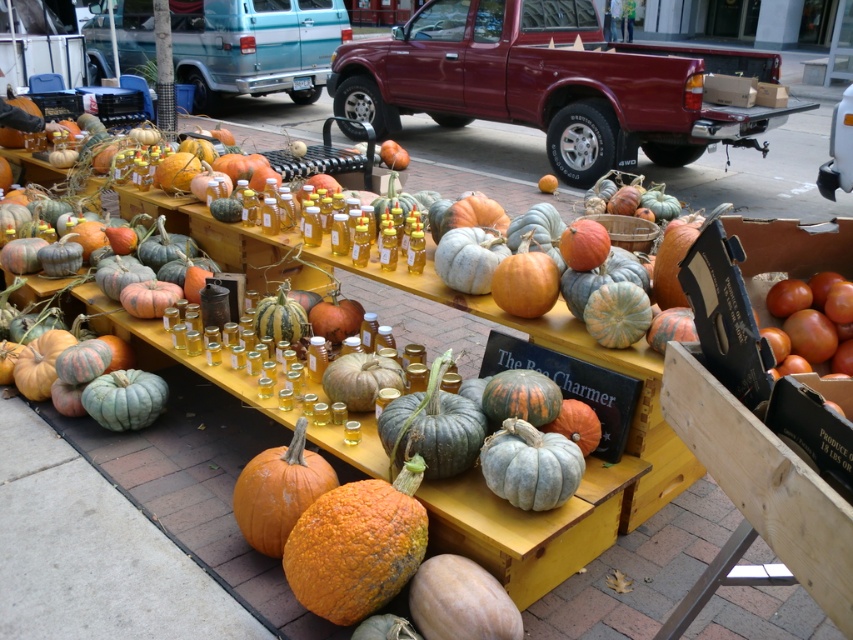
Does orange matte pumpkin at center appear on the right side of speckled gray pumpkin at center?

Incorrect, orange matte pumpkin at center is not on the right side of speckled gray pumpkin at center.

Between orange matte pumpkin at center and speckled gray pumpkin at center, which one has more height?

orange matte pumpkin at center

The image size is (853, 640). What do you see at coordinates (279, 490) in the screenshot?
I see `orange matte pumpkin at center` at bounding box center [279, 490].

Identify the location of orange matte pumpkin at center. (279, 490).

Who is more forward, (276, 541) or (502, 637)?

Point (502, 637)

I want to click on orange matte pumpkin at center, so click(x=279, y=490).

Is matte orange pumpkin at center positioned in front of speckled gray pumpkin at center?

Yes.

Is matte orange pumpkin at center bigger than speckled gray pumpkin at center?

Indeed, matte orange pumpkin at center has a larger size compared to speckled gray pumpkin at center.

Describe the element at coordinates (460, 602) in the screenshot. I see `matte orange pumpkin at center` at that location.

The width and height of the screenshot is (853, 640). In order to click on matte orange pumpkin at center in this screenshot , I will do point(460,602).